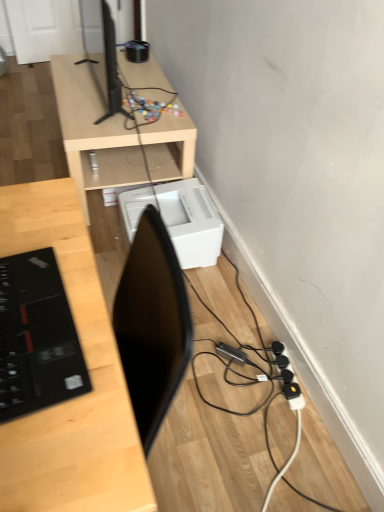
Question: Is light wood/finished desk at upper center, positioned as the second desk in front-to-back order, not within light wood desk at center, which is the first desk from bottom to top?

Choices:
 (A) yes
 (B) no

Answer: (A)

Question: Does light wood/finished desk at upper center, the 1th desk from the top, appear on the right side of light wood desk at center, which is the first desk from bottom to top?

Choices:
 (A) yes
 (B) no

Answer: (B)

Question: Could you tell me if light wood/finished desk at upper center, which appears as the 2th desk when ordered from the bottom, is turned towards light wood desk at center, which is the first desk from bottom to top?

Choices:
 (A) no
 (B) yes

Answer: (A)

Question: From the image's perspective, does light wood/finished desk at upper center, which appears as the 2th desk when ordered from the bottom, appear higher than light wood desk at center, which is the second desk in back-to-front order?

Choices:
 (A) yes
 (B) no

Answer: (A)

Question: Is light wood desk at center, which is the first desk from bottom to top, completely or partially inside light wood/finished desk at upper center, the 1th desk from the top?

Choices:
 (A) no
 (B) yes

Answer: (A)

Question: Is light wood/finished desk at upper center, marked as the first desk in a back-to-front arrangement, smaller than light wood desk at center, which is the first desk from bottom to top?

Choices:
 (A) no
 (B) yes

Answer: (B)

Question: Does black glossy laptop at left have a greater height compared to white plastic printer at lower center?

Choices:
 (A) yes
 (B) no

Answer: (A)

Question: From a real-world perspective, is black glossy laptop at left physically above white plastic printer at lower center?

Choices:
 (A) no
 (B) yes

Answer: (B)

Question: Is black glossy laptop at left wider than white plastic printer at lower center?

Choices:
 (A) no
 (B) yes

Answer: (A)

Question: From a real-world perspective, is black glossy laptop at left beneath white plastic printer at lower center?

Choices:
 (A) yes
 (B) no

Answer: (B)

Question: Considering the relative sizes of black glossy laptop at left and white plastic printer at lower center in the image provided, is black glossy laptop at left shorter than white plastic printer at lower center?

Choices:
 (A) no
 (B) yes

Answer: (A)

Question: Could white plastic printer at lower center be considered to be inside black glossy laptop at left?

Choices:
 (A) no
 (B) yes

Answer: (A)

Question: From a real-world perspective, is white plastic printer at lower center beneath black plastic extension cord at lower right?

Choices:
 (A) no
 (B) yes

Answer: (A)